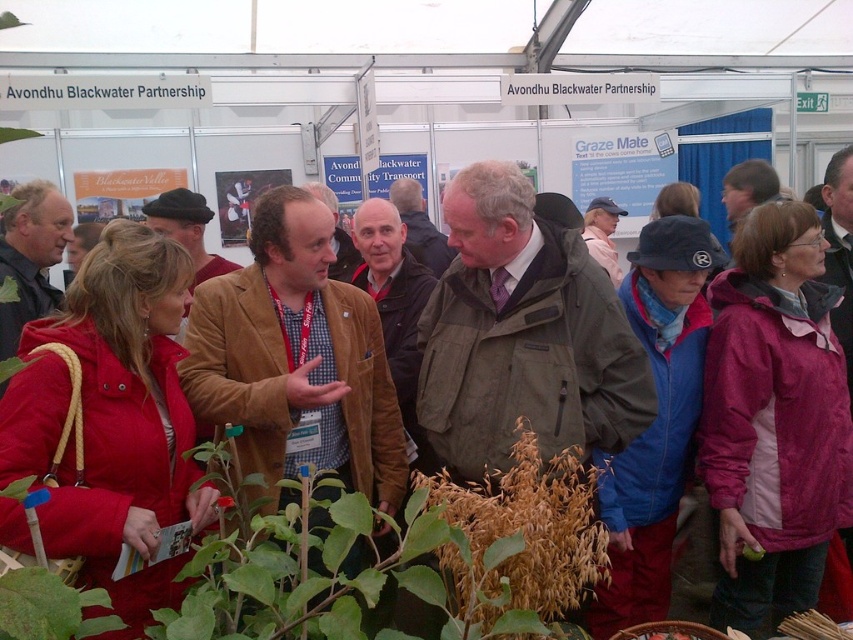
You are organizing a photo shoot and need to place two jackets in the scene. The matte red jacket at lower left and the pink fabric jacket at lower right are already positioned. Which jacket takes up more space in the photo?

The pink fabric jacket at lower right occupies more space than the matte red jacket at lower left.

You are a gardener who needs to move the brown textured plant at center to the green leafy plant at lower left to create a new arrangement. Can you do this without moving any other plants, considering the space between them?

The distance between the brown textured plant at center and the green leafy plant at lower left is 28.64 inches, so yes, you can move the brown textured plant at center to the green leafy plant at lower left without needing to move other plants as there is sufficient space between them.